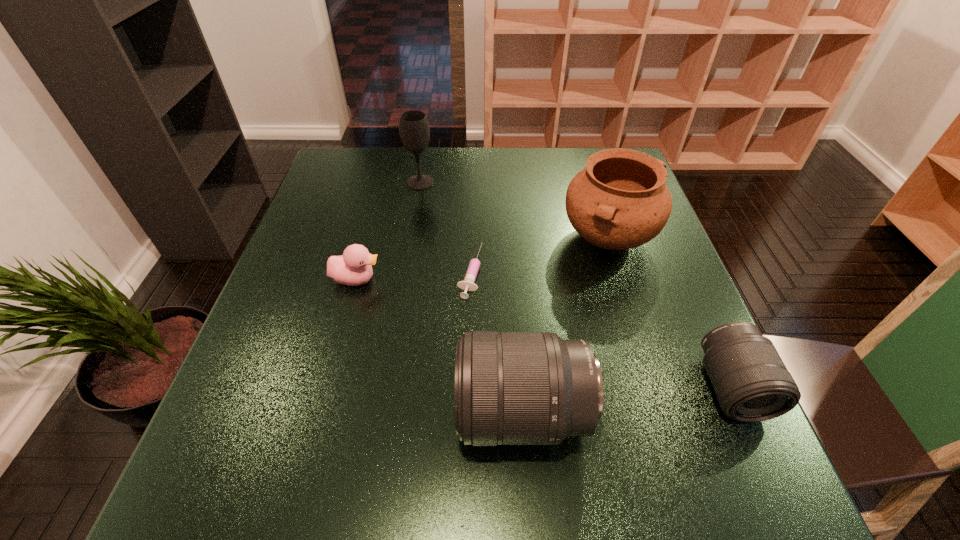
Locate an element on the screen. This screenshot has height=540, width=960. the left telephoto lens is located at coordinates (512, 388).

Locate an element on the screen. The image size is (960, 540). the right telephoto lens is located at coordinates (751, 382).

This screenshot has width=960, height=540. Find the location of `wineglass`. wineglass is located at coordinates (414, 129).

Where is `the second object from left to right`? the second object from left to right is located at coordinates (414, 129).

I want to click on the shortest object, so click(467, 284).

Image resolution: width=960 pixels, height=540 pixels. I want to click on pottery, so click(620, 201).

This screenshot has height=540, width=960. Identify the location of the leftmost object. (353, 268).

Find the location of `the second shortest object`. the second shortest object is located at coordinates pyautogui.click(x=353, y=268).

The width and height of the screenshot is (960, 540). I want to click on free spot located 0.230m on the surface of the taller telephoto lens, so click(329, 413).

Where is `free space located 0.210m on the surface of the taller telephoto lens`? free space located 0.210m on the surface of the taller telephoto lens is located at coordinates (341, 413).